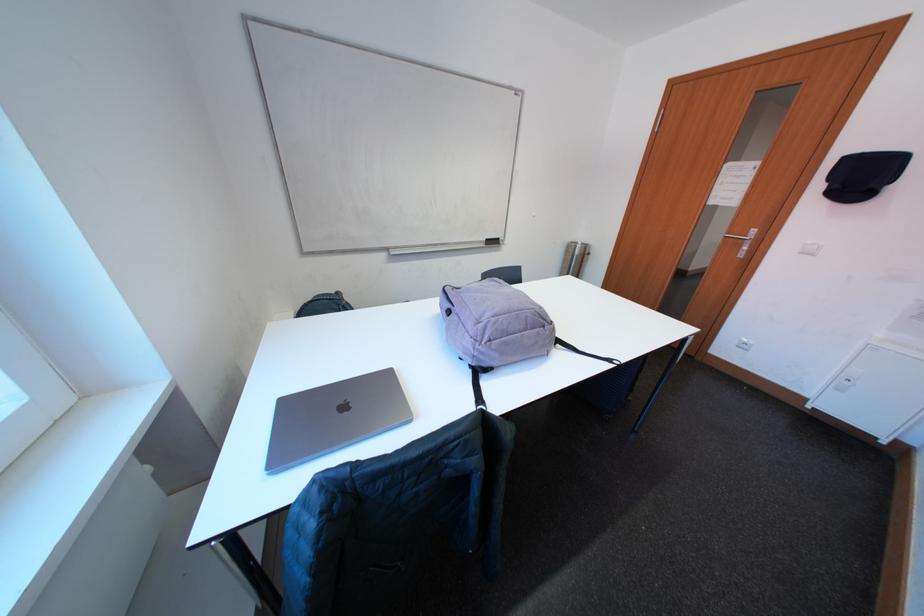
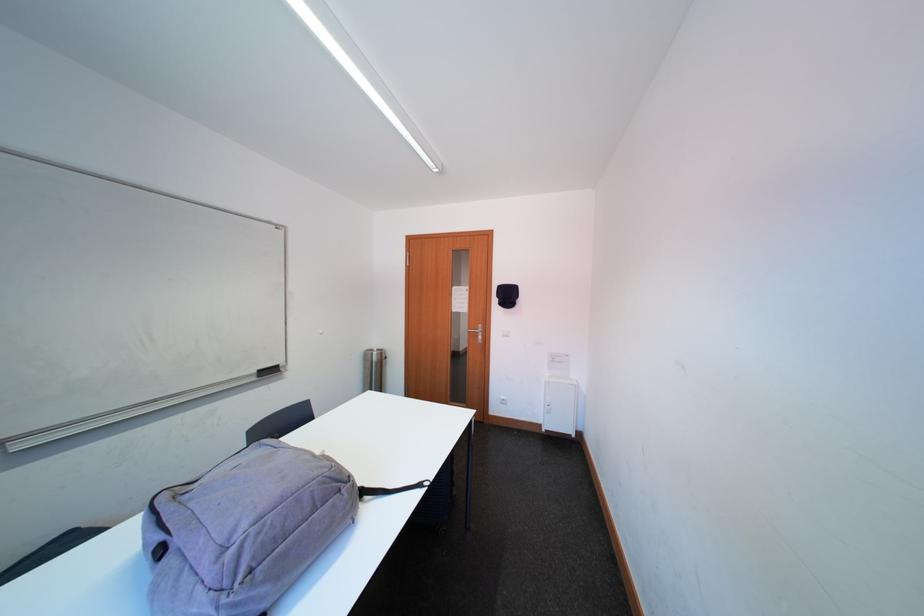
Question: The camera is either moving clockwise (left) or counter-clockwise (right) around the object. The first image is from the beginning of the video and the second image is from the end. Is the camera moving left or right when shooting the video?

Choices:
 (A) Left
 (B) Right

Answer: (A)